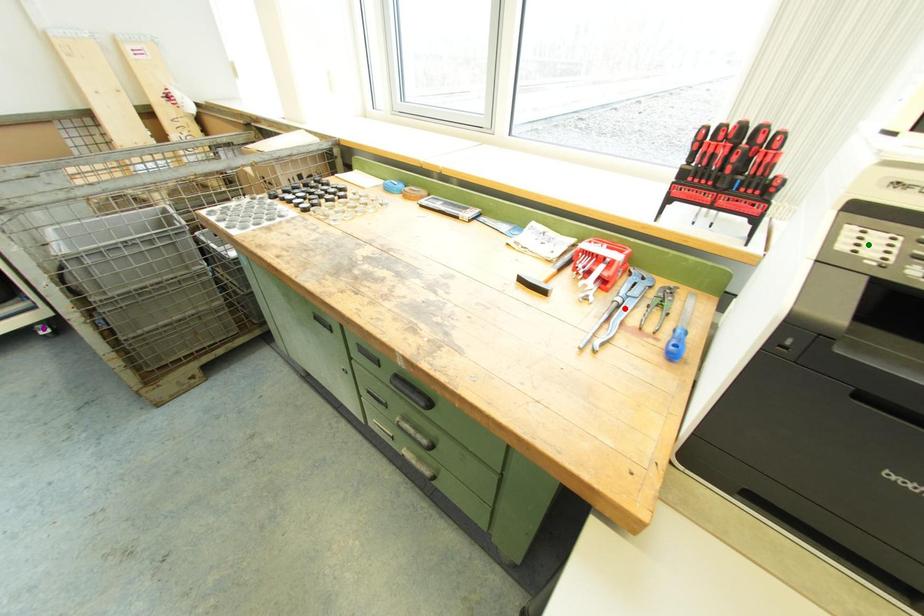
Order these from nearest to farthest:
1. purple point
2. green point
3. red point

1. green point
2. red point
3. purple point